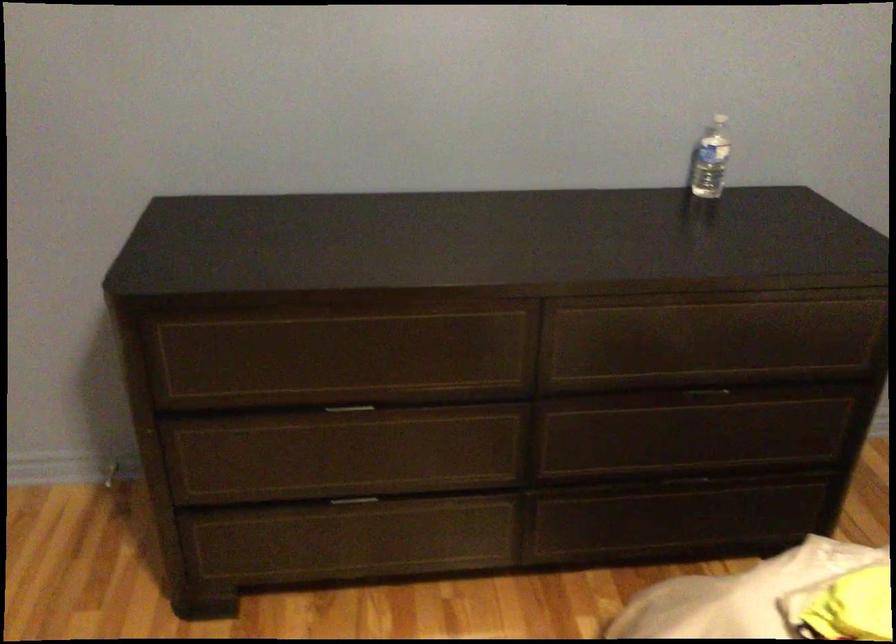
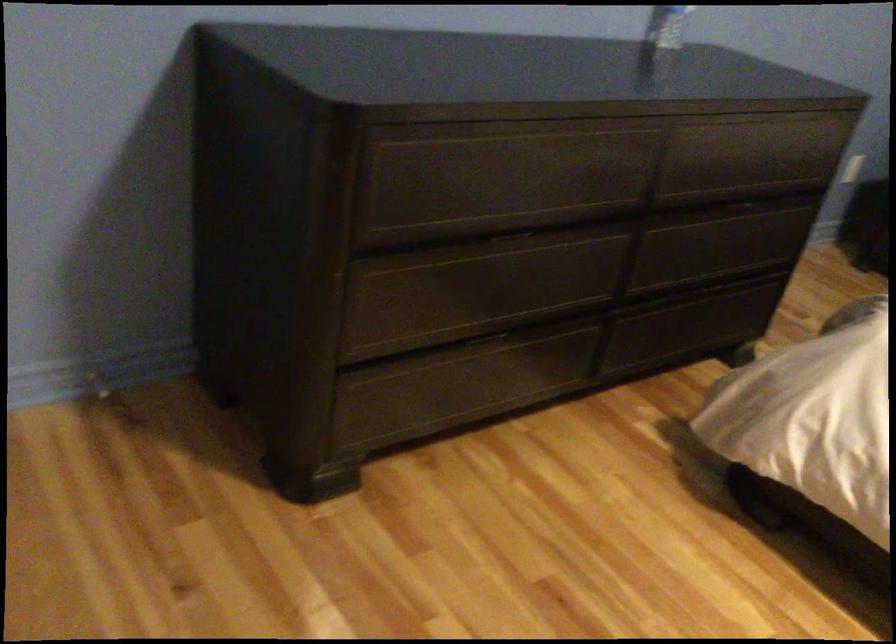
Question: The images are taken continuously from a first-person perspective. In which direction are you moving?

Choices:
 (A) Left
 (B) Right
 (C) Forward
 (D) Backward

Answer: (A)